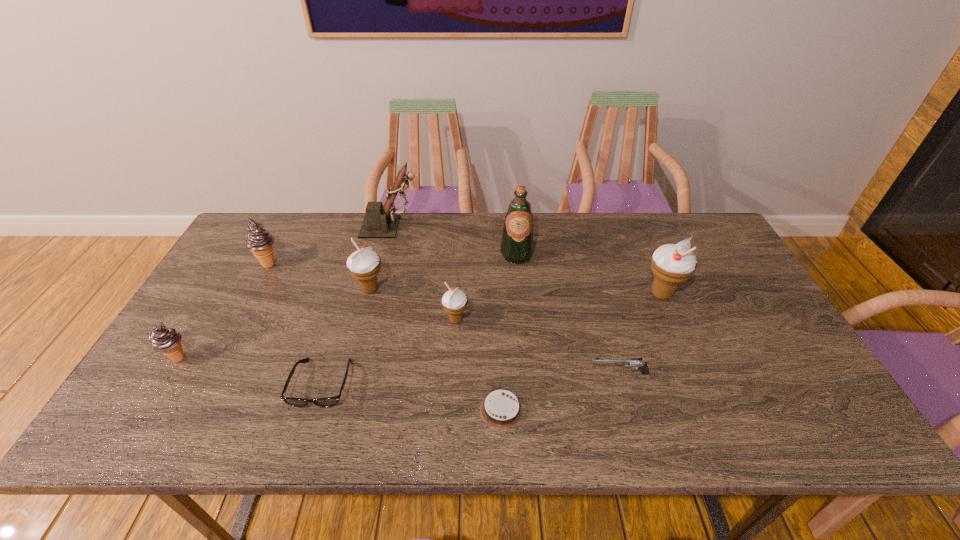
At what (x,y) coordinates should I click in order to perform the action: click on free space in the image that satisfies the following two spatial constraints: 1. on the front-facing side of the third tallest object; 2. on the left side of the farthest object. Please return your answer as a coordinate pair (x, y). Looking at the image, I should click on (374, 294).